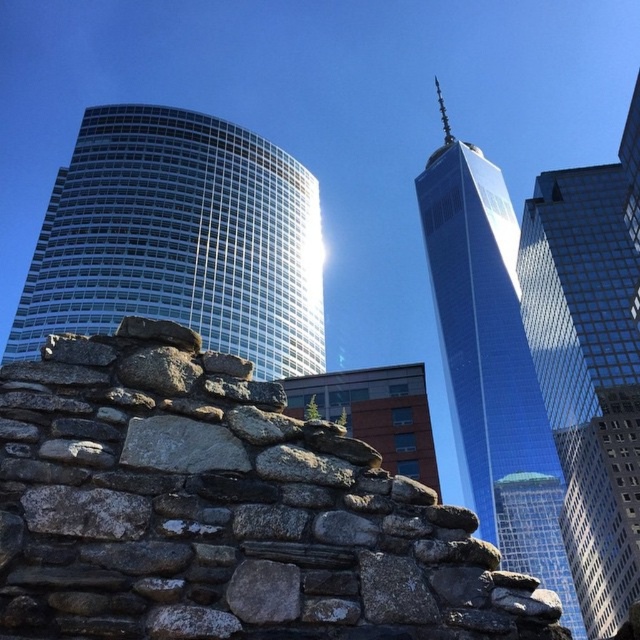
Question: Which is nearer to the shiny glass skyscraper at center?

Choices:
 (A) gray rough stone wall at center
 (B) white glass building at left
 (C) glassy blue skyscraper at center

Answer: (C)

Question: Which point appears farthest from the camera in this image?

Choices:
 (A) (577, 262)
 (B) (472, 282)
 (C) (99, 428)
 (D) (276, 300)

Answer: (B)

Question: Does gray rough stone wall at center have a lesser width compared to shiny glass skyscraper at center?

Choices:
 (A) yes
 (B) no

Answer: (A)

Question: Which point appears farthest from the camera in this image?

Choices:
 (A) (577, 538)
 (B) (168, 108)
 (C) (372, 515)
 (D) (506, 188)

Answer: (D)

Question: Observing the image, what is the correct spatial positioning of white glass building at left in reference to glassy blue skyscraper at center?

Choices:
 (A) above
 (B) below

Answer: (A)

Question: Can you confirm if gray rough stone wall at center is positioned below glassy blue skyscraper at center?

Choices:
 (A) yes
 (B) no

Answer: (B)